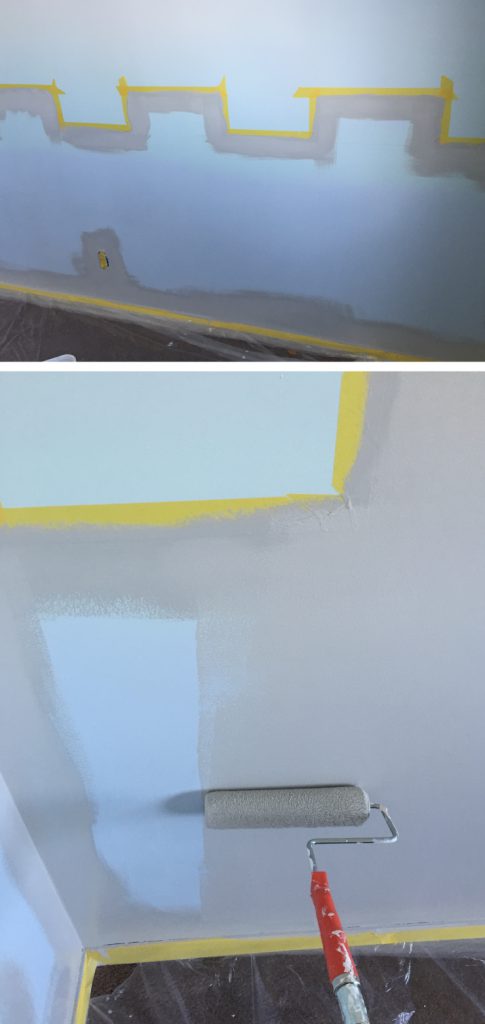
Where is `yellow tape holding plastic covering onto bottom of wall`? The height and width of the screenshot is (1024, 485). yellow tape holding plastic covering onto bottom of wall is located at coordinates (88, 976), (203, 947), (184, 314).